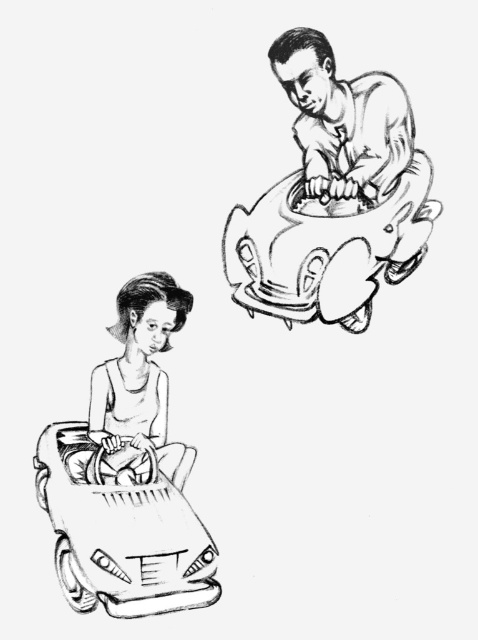
Does smooth plastic toy car at upper right have a greater height compared to smooth skin child at lower left?

Incorrect, smooth plastic toy car at upper right's height is not larger of smooth skin child at lower left's.

Is point (254, 292) behind point (144, 371)?

Yes, it is.

Find the location of a particular element. The height and width of the screenshot is (640, 478). smooth plastic toy car at upper right is located at coordinates (326, 250).

Who is higher up, smooth plastic toy car at lower left or smooth skin child at lower left?

Positioned higher is smooth skin child at lower left.

Which is in front, point (54, 561) or point (161, 396)?

Positioned in front is point (54, 561).

Identify the location of smooth plastic toy car at lower left. This screenshot has width=478, height=640. (120, 532).

The image size is (478, 640). Find the location of `smooth plastic toy car at lower left`. smooth plastic toy car at lower left is located at coordinates (120, 532).

Is smooth plastic toy car at upper right below smooth skin man at upper center?

Yes, smooth plastic toy car at upper right is below smooth skin man at upper center.

Is smooth plastic toy car at upper right smaller than smooth skin man at upper center?

Actually, smooth plastic toy car at upper right might be larger than smooth skin man at upper center.

Does point (338, 237) come closer to viewer compared to point (325, 102)?

No, (338, 237) is further to viewer.

At what (x,y) coordinates should I click in order to perform the action: click on smooth plastic toy car at upper right. Please return your answer as a coordinate pair (x, y). This screenshot has width=478, height=640. Looking at the image, I should click on (326, 250).